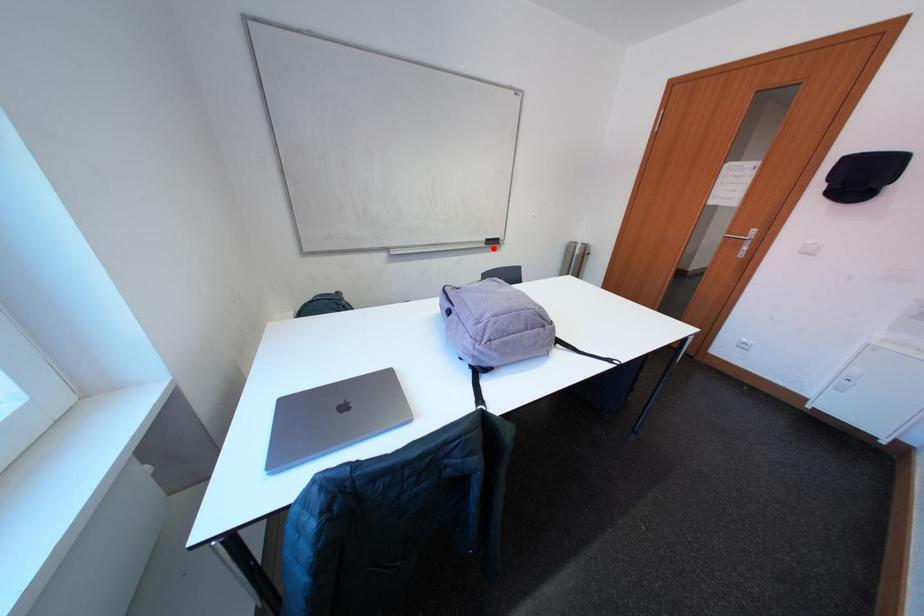
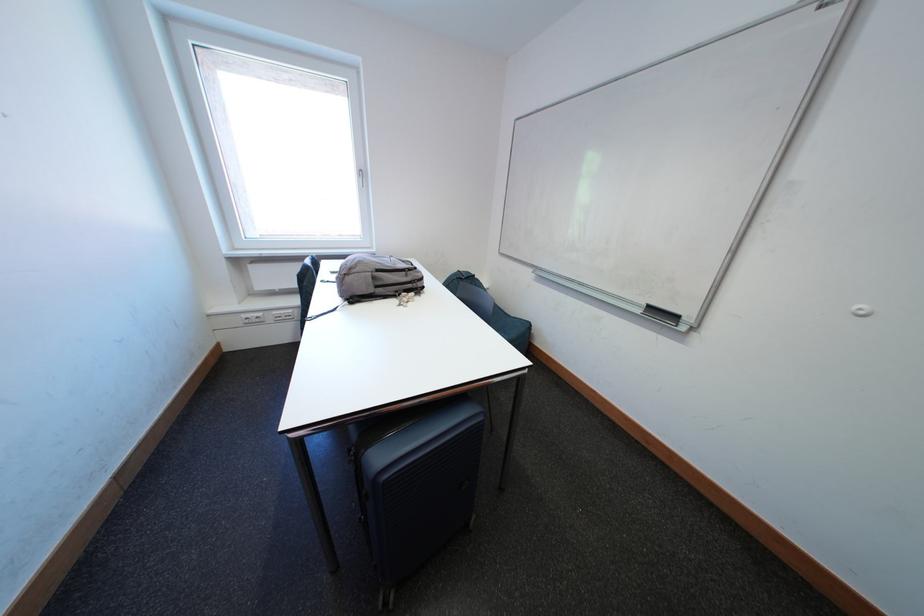
Question: A red point is marked in image1. In image2, is the corresponding 3D point closer to the camera or farther? Reply with the corresponding letter.

Choices:
 (A) The corresponding 3D point is closer.
 (B) The corresponding 3D point is farther.

Answer: (A)